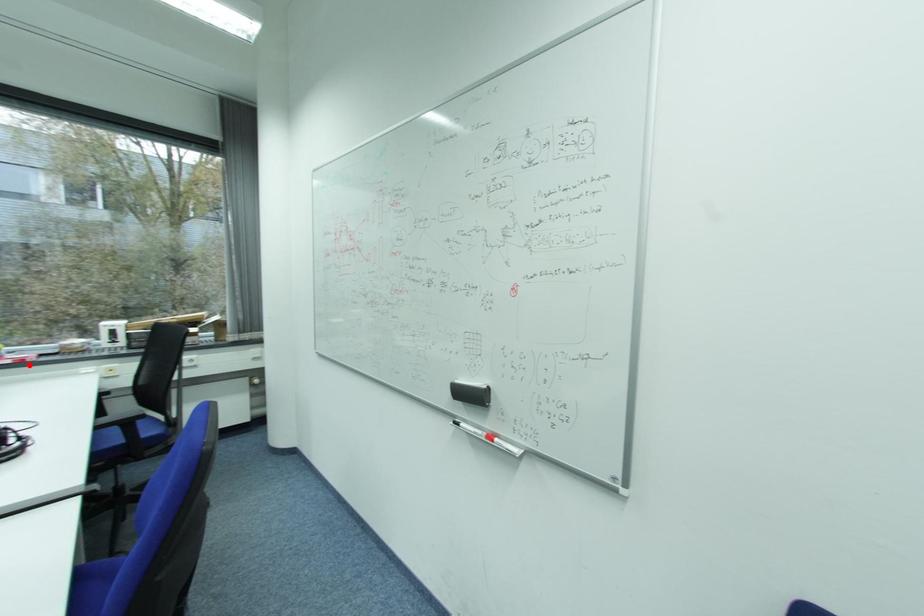
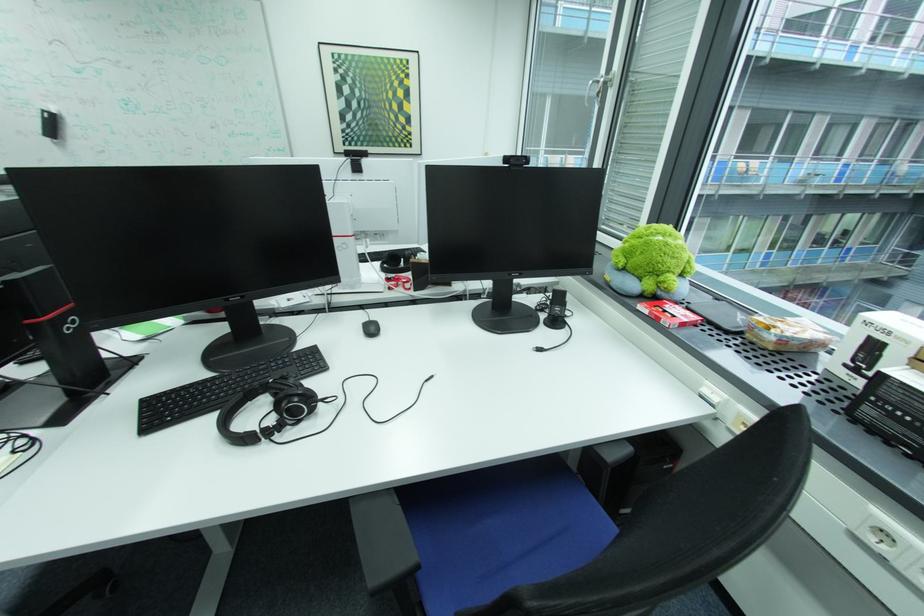
Question: A red point is marked in image1. In image2, is the corresponding 3D point closer to the camera or farther? Reply with the corresponding letter.

Choices:
 (A) The corresponding 3D point is closer.
 (B) The corresponding 3D point is farther.

Answer: (A)